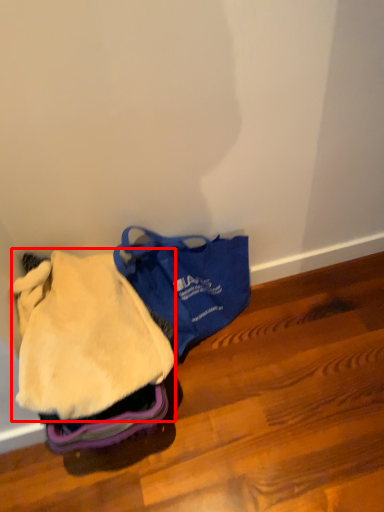
Question: Observing the image, what is the correct spatial positioning of clothing (annotated by the red box) in reference to luggage and bags?

Choices:
 (A) right
 (B) left

Answer: (B)